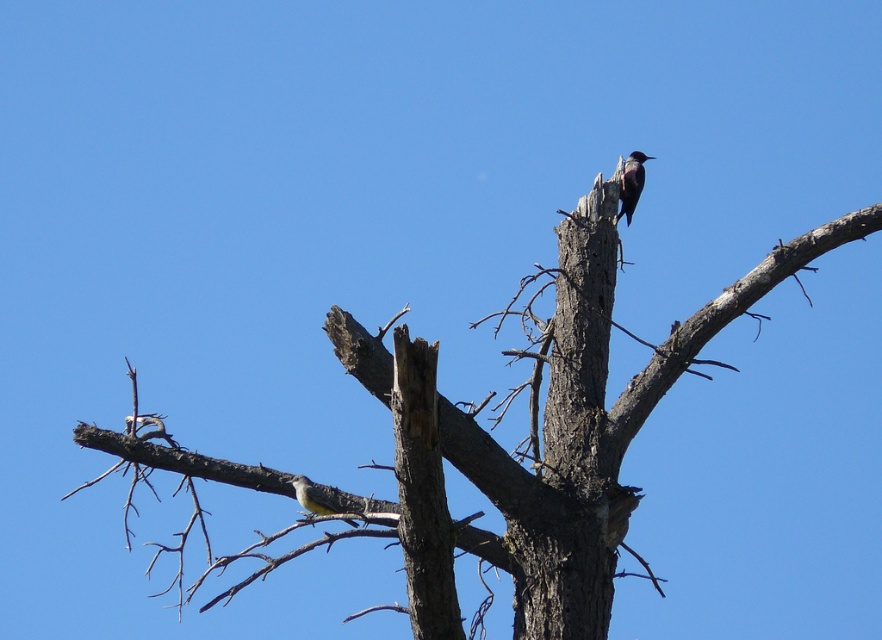
Is point (439, 627) positioned before point (323, 509)?

That is True.

Who is positioned more to the right, smooth bark tree trunk at upper center or yellow-green feathers at center?

From the viewer's perspective, smooth bark tree trunk at upper center appears more on the right side.

Is point (705, 378) farther from viewer compared to point (308, 481)?

That is True.

Find the location of a particular element. smooth bark tree trunk at upper center is located at coordinates (537, 435).

Does smooth bark tree trunk at upper center appear under shiny black woodpecker at upper right?

Yes.

Is point (490, 461) closer to viewer compared to point (641, 168)?

Yes, point (490, 461) is closer to viewer.

Is point (529, 560) closer to viewer compared to point (622, 176)?

Yes, point (529, 560) is closer to viewer.

This screenshot has width=882, height=640. Find the location of `smooth bark tree trunk at upper center`. smooth bark tree trunk at upper center is located at coordinates (537, 435).

Can you confirm if shiny black woodpecker at upper right is shorter than yellow-green feathers at center?

In fact, shiny black woodpecker at upper right may be taller than yellow-green feathers at center.

Does shiny black woodpecker at upper right have a lesser width compared to yellow-green feathers at center?

No, shiny black woodpecker at upper right is not thinner than yellow-green feathers at center.

Does point (634, 164) lie in front of point (325, 515)?

No, it is not.

Where is `shiny black woodpecker at upper right`? Image resolution: width=882 pixels, height=640 pixels. shiny black woodpecker at upper right is located at coordinates pyautogui.click(x=632, y=182).